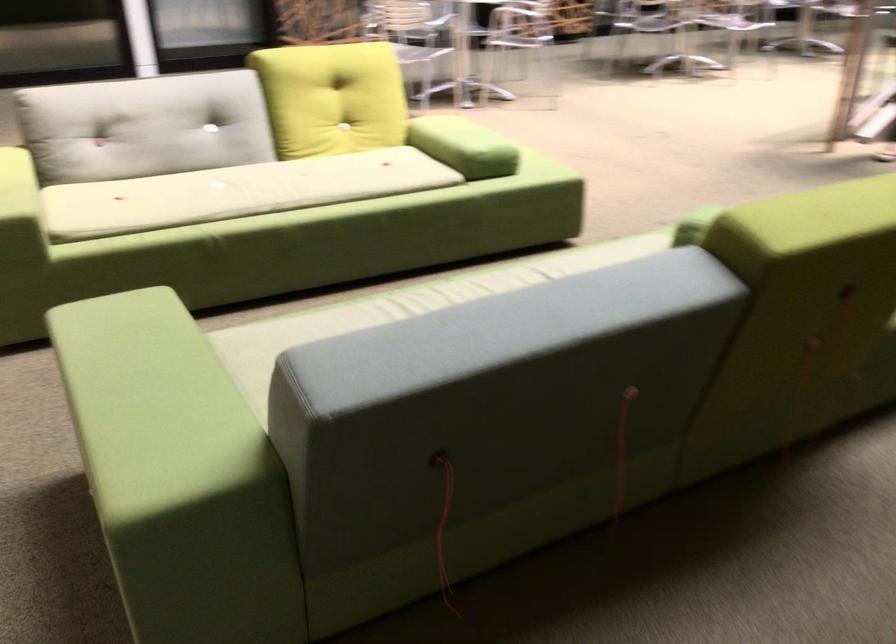
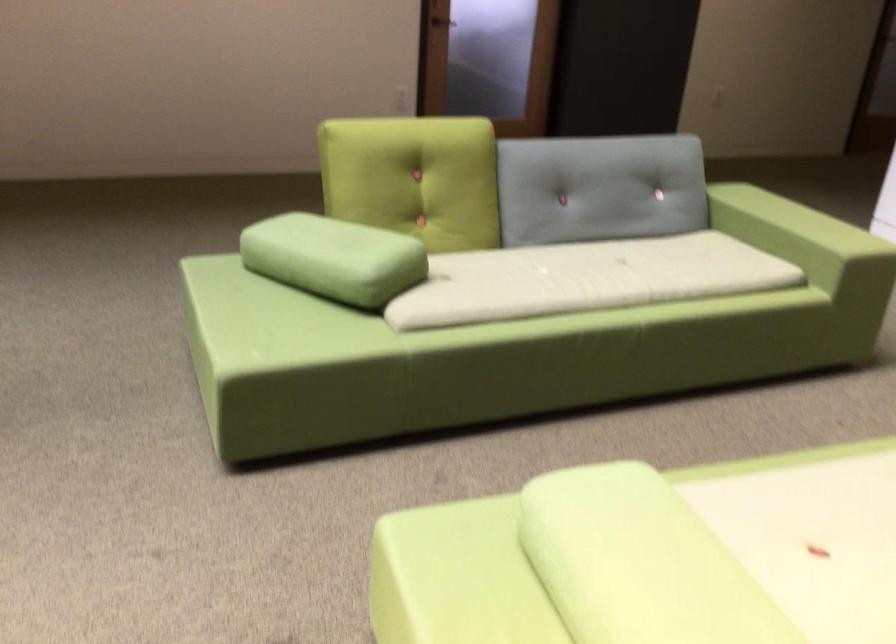
Find the pixel in the second image that matches (464,125) in the first image.

(651, 556)